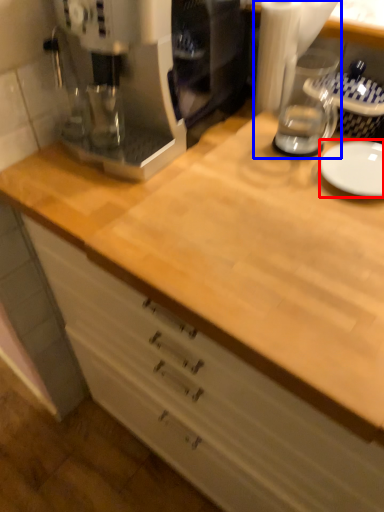
Question: Among these objects, which one is farthest to the camera, plate (highlighted by a red box) or blender (highlighted by a blue box)?

Choices:
 (A) plate
 (B) blender

Answer: (A)